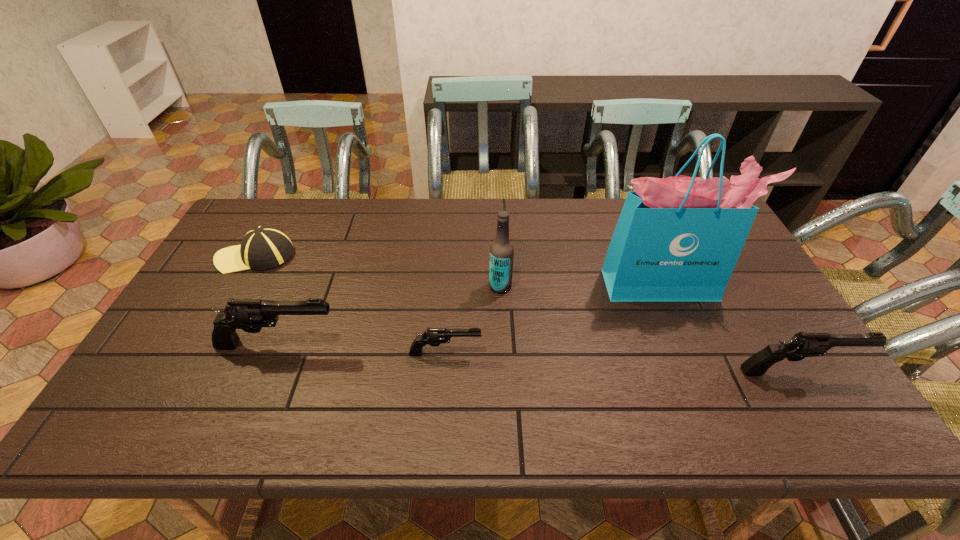
The height and width of the screenshot is (540, 960). In order to click on the leftmost gun in this screenshot , I will do `click(250, 315)`.

Find the location of a particular element. The height and width of the screenshot is (540, 960). the shortest gun is located at coordinates (434, 337).

The image size is (960, 540). Find the location of `the second gun from right to left`. the second gun from right to left is located at coordinates (434, 337).

What are the coordinates of `the rightmost gun` in the screenshot? It's located at (801, 345).

The height and width of the screenshot is (540, 960). I want to click on the nearest gun, so click(801, 345).

Where is `the tallest object`? The width and height of the screenshot is (960, 540). the tallest object is located at coordinates (678, 239).

This screenshot has height=540, width=960. What are the coordinates of `beer bottle` in the screenshot? It's located at (501, 250).

You are a GUI agent. You are given a task and a screenshot of the screen. Output one action in this format:
    pyautogui.click(x=<x>, y=<y>)
    Task: Click on the fourth object from left to right
    The height and width of the screenshot is (540, 960).
    Given the screenshot: What is the action you would take?
    pyautogui.click(x=501, y=250)

Find the location of a particular element. This screenshot has height=540, width=960. baseball cap is located at coordinates (264, 247).

This screenshot has width=960, height=540. In order to click on vacant region located at the end of the barrel of the leftmost gun in this screenshot , I will do [x=421, y=345].